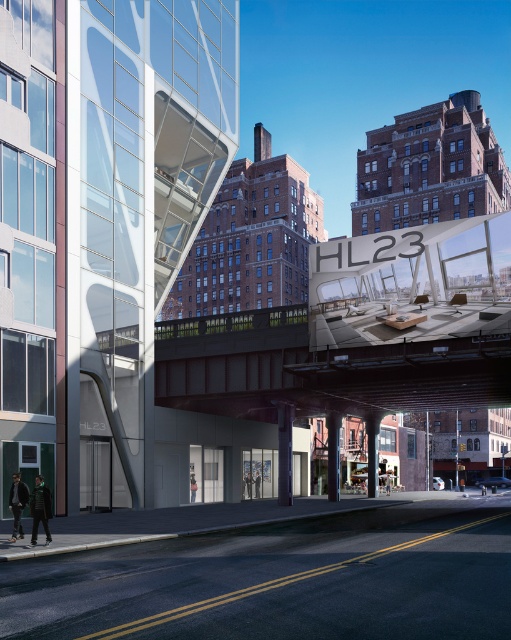
Question: Which point is farther to the camera?

Choices:
 (A) (9, 493)
 (B) (45, 538)

Answer: (A)

Question: From the image, what is the correct spatial relationship of dark green jacket at lower left in relation to dark gray jacket at lower left?

Choices:
 (A) below
 (B) above

Answer: (A)

Question: Among these objects, which one is nearest to the camera?

Choices:
 (A) dark green jacket at lower left
 (B) dark gray jacket at lower left

Answer: (A)

Question: Among these points, which one is nearest to the camera?

Choices:
 (A) (13, 513)
 (B) (49, 538)

Answer: (B)

Question: Can you confirm if dark green jacket at lower left is positioned above dark gray jacket at lower left?

Choices:
 (A) no
 (B) yes

Answer: (A)

Question: From the image, what is the correct spatial relationship of dark green jacket at lower left in relation to dark gray jacket at lower left?

Choices:
 (A) right
 (B) left

Answer: (A)